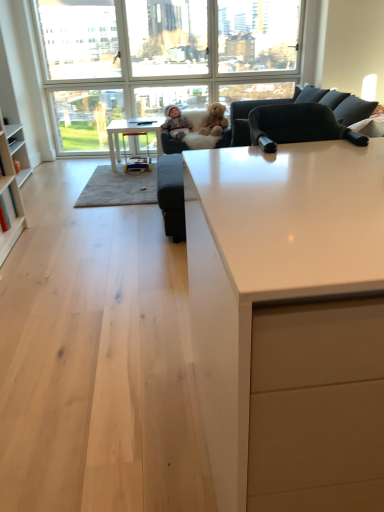
This screenshot has width=384, height=512. Identify the location of free point above wooden stool at center (from a real-world perspective). (126, 125).